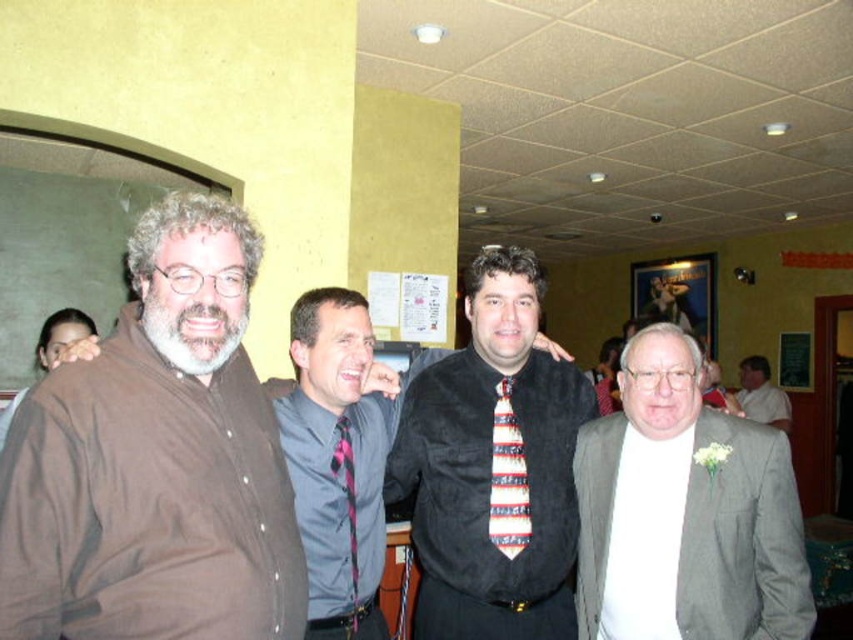
Looking at this image, is the position of brown shirt at left more distant than that of black velvet shirt at center?

No, brown shirt at left is in front of black velvet shirt at center.

Can you confirm if brown shirt at left is positioned above black velvet shirt at center?

Indeed, brown shirt at left is positioned over black velvet shirt at center.

Find the location of `brown shirt at left`. brown shirt at left is located at coordinates (155, 460).

Which is more to the right, black velvet shirt at center or striped silk tie at center?

striped silk tie at center is more to the right.

Is black velvet shirt at center above striped silk tie at center?

No.

Where is `black velvet shirt at center`? The height and width of the screenshot is (640, 853). black velvet shirt at center is located at coordinates (x=492, y=467).

At what (x,y) coordinates should I click in order to perform the action: click on brown shirt at left. Please return your answer as a coordinate pair (x, y). The width and height of the screenshot is (853, 640). Looking at the image, I should click on (155, 460).

Does brown shirt at left have a larger size compared to striped silk tie at center?

Indeed, brown shirt at left has a larger size compared to striped silk tie at center.

This screenshot has width=853, height=640. Describe the element at coordinates (155, 460) in the screenshot. I see `brown shirt at left` at that location.

You are a GUI agent. You are given a task and a screenshot of the screen. Output one action in this format:
    pyautogui.click(x=<x>, y=<y>)
    Task: Click on the brown shirt at left
    
    Given the screenshot: What is the action you would take?
    pyautogui.click(x=155, y=460)